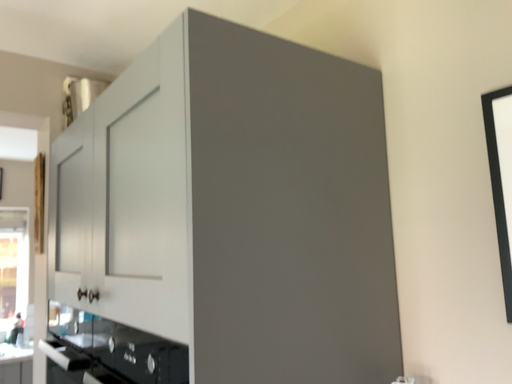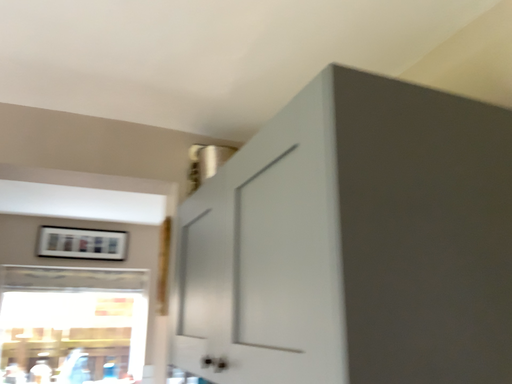
Question: How did the camera likely rotate when shooting the video?

Choices:
 (A) rotated right
 (B) rotated left

Answer: (B)